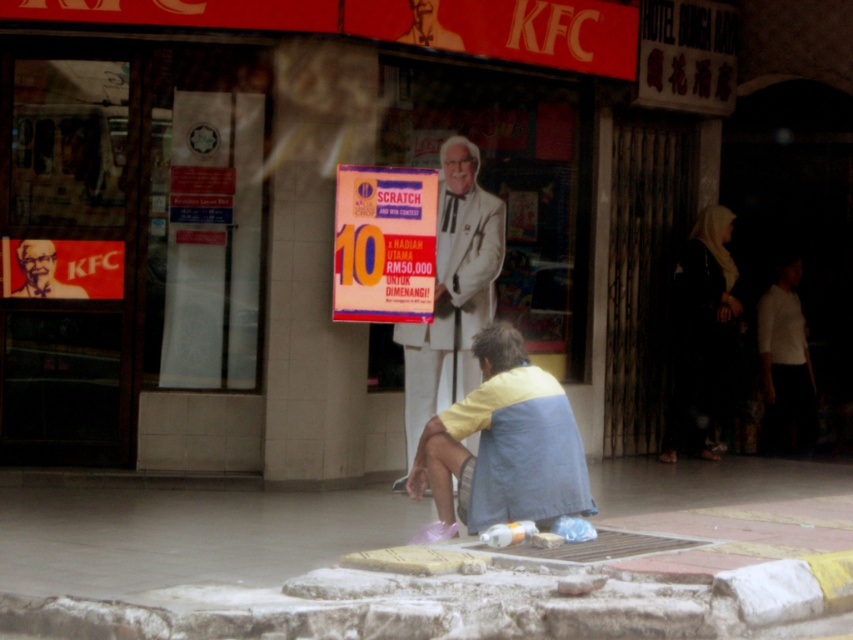
Question: Does yellow fabric at lower center have a larger size compared to white suit at center?

Choices:
 (A) no
 (B) yes

Answer: (A)

Question: Which point appears closest to the camera in this image?

Choices:
 (A) (207, 561)
 (B) (492, 422)
 (C) (469, 282)

Answer: (B)

Question: Can you confirm if concrete at lower center is thinner than yellow fabric at lower center?

Choices:
 (A) no
 (B) yes

Answer: (A)

Question: Does concrete at lower center have a lesser width compared to white suit at center?

Choices:
 (A) yes
 (B) no

Answer: (B)

Question: Estimate the real-world distances between objects in this image. Which object is farther from the white suit at center?

Choices:
 (A) concrete at lower center
 (B) yellow fabric at lower center

Answer: (A)

Question: Which object is positioned farthest from the concrete at lower center?

Choices:
 (A) white suit at center
 (B) yellow fabric at lower center

Answer: (A)